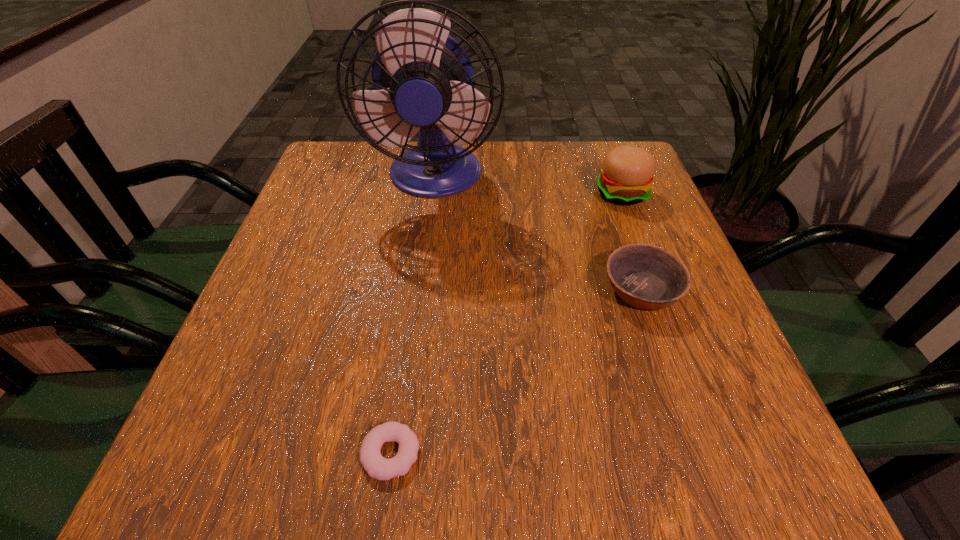
In order to click on vacant space that satisfies the following two spatial constraints: 1. in front of the third farthest object where the airflow is directed; 2. on the left side of the fan in this screenshot , I will do `click(420, 290)`.

Where is `free region that satisfies the following two spatial constraints: 1. in front of the tallest object where the airflow is directed; 2. on the left side of the third tallest object`? This screenshot has height=540, width=960. free region that satisfies the following two spatial constraints: 1. in front of the tallest object where the airflow is directed; 2. on the left side of the third tallest object is located at coordinates (420, 290).